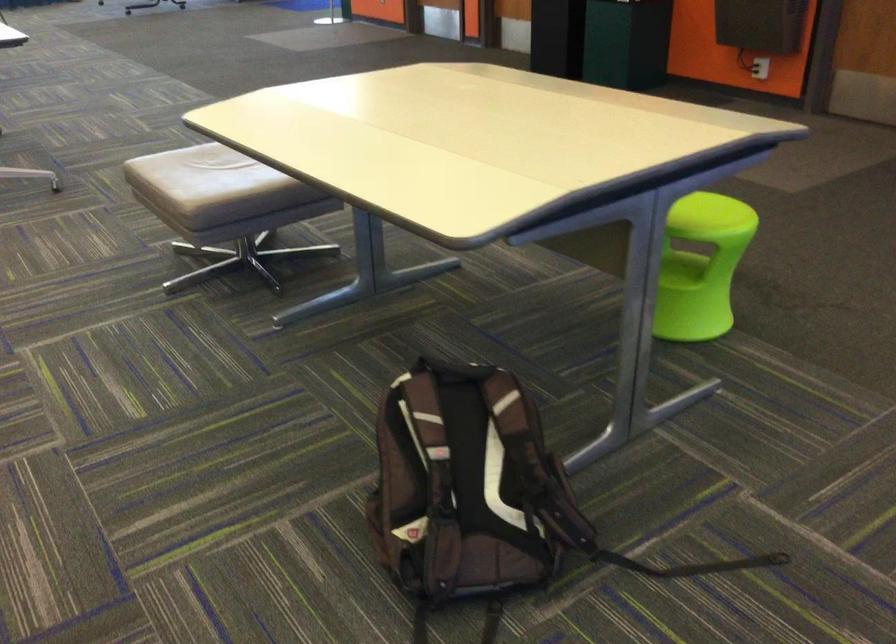
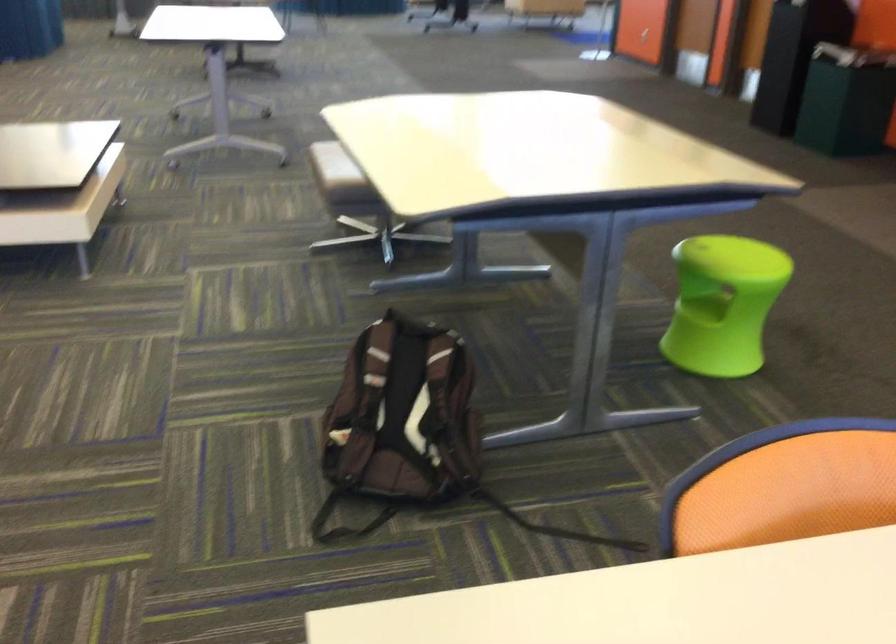
In the second image, find the point that corresponds to (684,201) in the first image.

(730, 247)